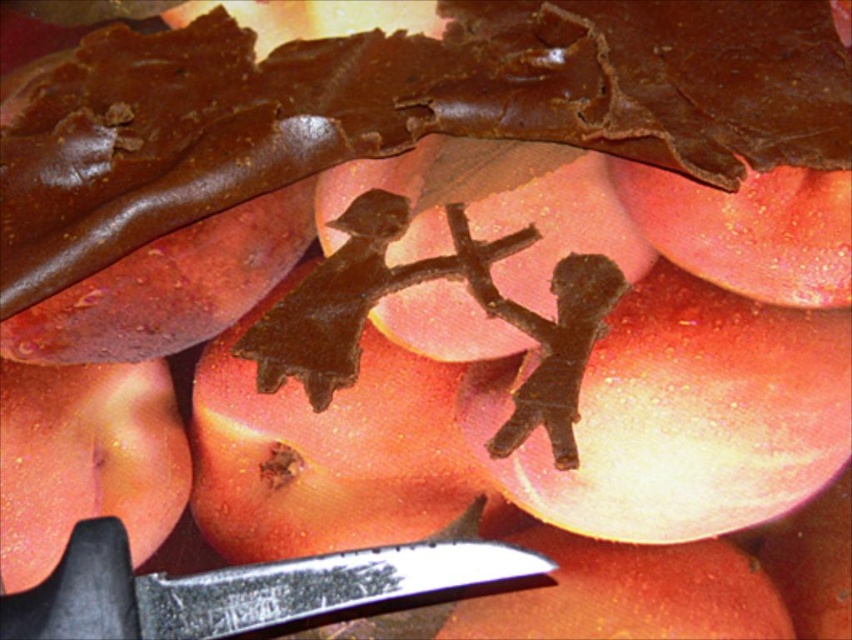
Between smooth dark brown chocolate cake at center and matte chocolate figure at center, which one is positioned lower?

Positioned lower is matte chocolate figure at center.

Is point (326, 51) closer to camera compared to point (801, 412)?

No, it is not.

Locate an element on the screen. The height and width of the screenshot is (640, 852). smooth dark brown chocolate cake at center is located at coordinates (403, 112).

Between matte chocolate figure at center and smooth brown chocolate at center, which one is positioned lower?

Positioned lower is smooth brown chocolate at center.

Who is taller, matte chocolate figure at center or smooth brown chocolate at center?

Standing taller between the two is smooth brown chocolate at center.

The height and width of the screenshot is (640, 852). I want to click on matte chocolate figure at center, so click(x=680, y=417).

Where is `matte chocolate figure at center`? This screenshot has width=852, height=640. matte chocolate figure at center is located at coordinates (680, 417).

This screenshot has height=640, width=852. What are the coordinates of `matte chocolate figure at center` in the screenshot? It's located at (680, 417).

The height and width of the screenshot is (640, 852). What do you see at coordinates (680, 417) in the screenshot?
I see `matte chocolate figure at center` at bounding box center [680, 417].

This screenshot has width=852, height=640. What are the coordinates of `matte chocolate figure at center` in the screenshot? It's located at (680, 417).

Where is `matte chocolate figure at center`? matte chocolate figure at center is located at coordinates (680, 417).